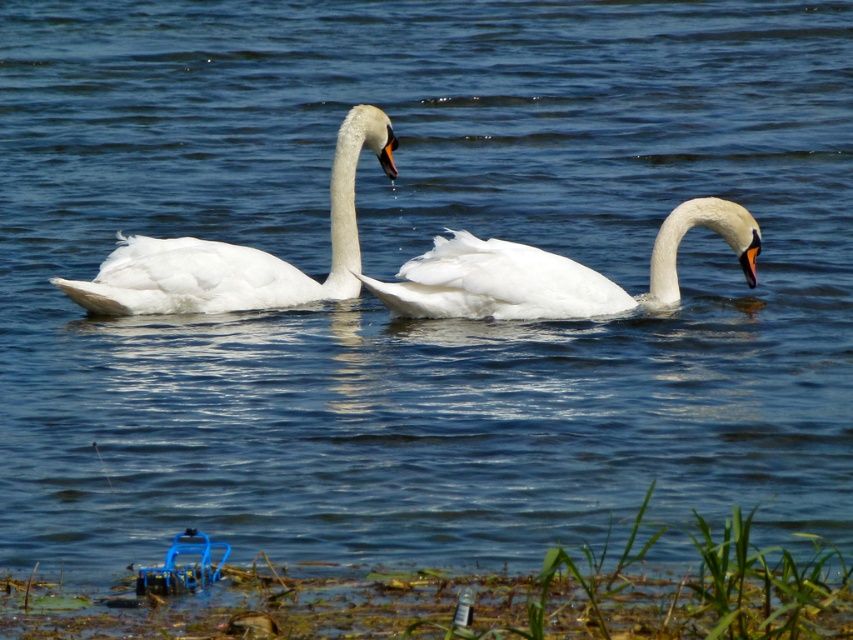
Question: Is white glossy swan at center closer to camera compared to white feathered swan at center?

Choices:
 (A) yes
 (B) no

Answer: (B)

Question: Does white glossy swan at center appear over white feathered swan at center?

Choices:
 (A) no
 (B) yes

Answer: (B)

Question: Can you confirm if white glossy swan at center is smaller than white feathered swan at center?

Choices:
 (A) no
 (B) yes

Answer: (A)

Question: Among these objects, which one is farthest from the camera?

Choices:
 (A) white glossy swan at center
 (B) white feathered swan at center

Answer: (A)

Question: Which point appears farthest from the camera in this image?

Choices:
 (A) (589, 276)
 (B) (346, 134)

Answer: (B)

Question: Which of the following is the closest to the observer?

Choices:
 (A) (621, 310)
 (B) (138, 241)

Answer: (B)